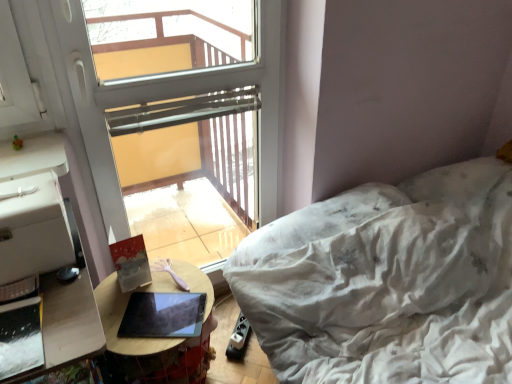
The width and height of the screenshot is (512, 384). Identify the location of vacant space situated above wooden table at lower left (from a real-world perspective). (155, 304).